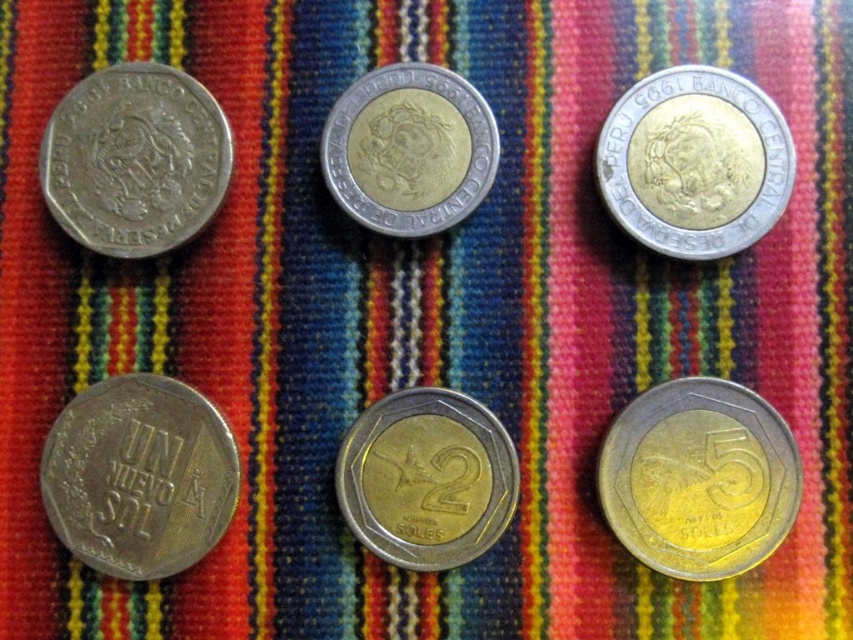
Is silver metallic coin at upper left bigger than gold-plated metal coin at center?

Yes.

Does silver metallic coin at upper left come behind gold-plated metal coin at center?

That is False.

Who is more distant from viewer, (67, 202) or (486, 541)?

Point (486, 541)

This screenshot has height=640, width=853. What are the coordinates of `silver metallic coin at upper left` in the screenshot? It's located at (135, 160).

Is silver metallic coin at upper right above silver/golden metallic coin at center?

Incorrect, silver metallic coin at upper right is not positioned above silver/golden metallic coin at center.

Does point (675, 81) come in front of point (352, 138)?

Yes, point (675, 81) is in front of point (352, 138).

Identify the location of silver metallic coin at upper right. (695, 163).

Is silver metallic coin at upper left thinner than silver/golden metallic coin at center?

Incorrect, silver metallic coin at upper left's width is not less than silver/golden metallic coin at center's.

Based on the photo, who is more distant from viewer, (213, 161) or (476, 144)?

The point (476, 144) is more distant.

Which is in front, point (123, 144) or point (397, 232)?

Positioned in front is point (123, 144).

Locate an element on the screen. This screenshot has width=853, height=640. silver metallic coin at upper left is located at coordinates (135, 160).